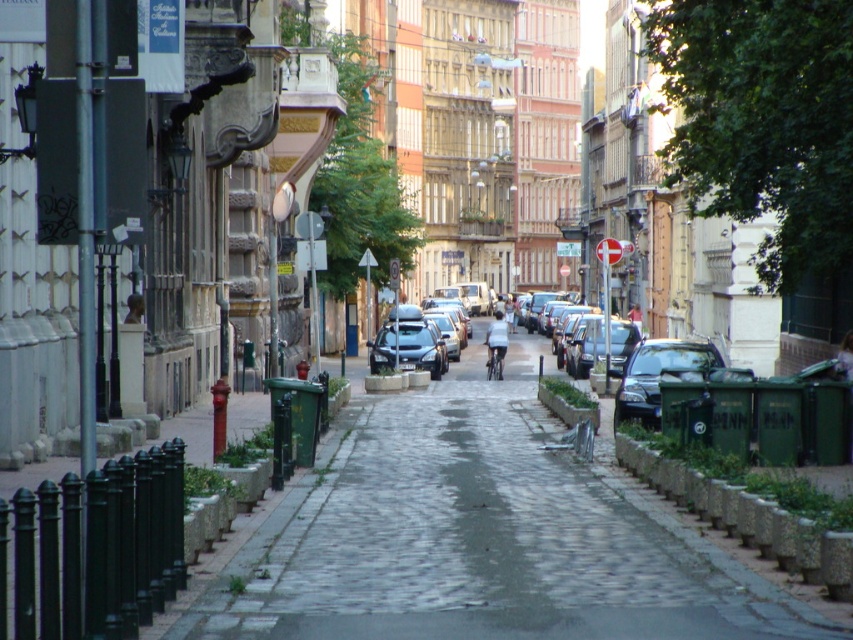
How far apart are metallic dark green car at right and light blue fabric shirt at center?

Result: The distance of metallic dark green car at right from light blue fabric shirt at center is 16.36 meters.

Which is more to the right, metallic dark green car at right or light blue fabric shirt at center?

Positioned to the right is metallic dark green car at right.

Is point (650, 376) positioned after point (496, 317)?

No, (650, 376) is closer to viewer.

Find the location of a particular element. The height and width of the screenshot is (640, 853). metallic dark green car at right is located at coordinates (659, 376).

Image resolution: width=853 pixels, height=640 pixels. Describe the element at coordinates (409, 348) in the screenshot. I see `satin black car at center` at that location.

Is satin black car at center thinner than light blue fabric shirt at center?

In fact, satin black car at center might be wider than light blue fabric shirt at center.

Which is behind, point (381, 358) or point (498, 314)?

The point (498, 314) is more distant.

Where is `satin black car at center`? satin black car at center is located at coordinates (409, 348).

Is cobblestone pavement at center above satin black car at center?

No, cobblestone pavement at center is not above satin black car at center.

Describe the element at coordinates (480, 541) in the screenshot. I see `cobblestone pavement at center` at that location.

Locate an element on the screen. Image resolution: width=853 pixels, height=640 pixels. cobblestone pavement at center is located at coordinates (480, 541).

The width and height of the screenshot is (853, 640). Identify the location of cobblestone pavement at center. (480, 541).